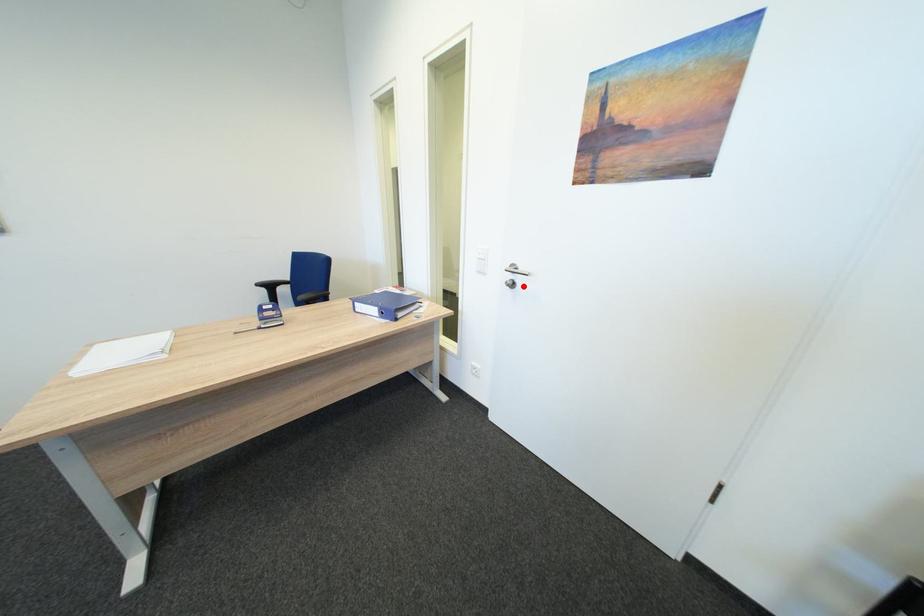
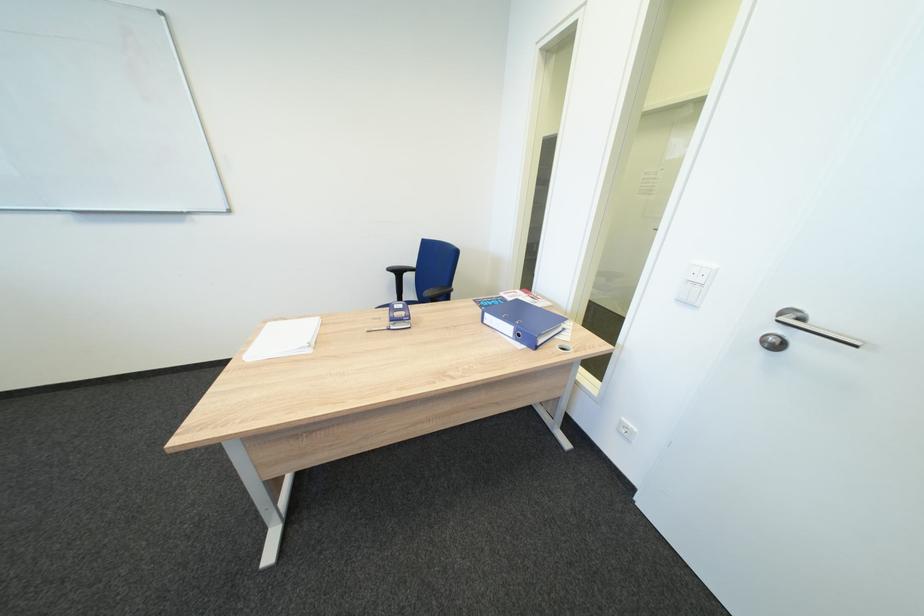
Locate, in the second image, the point that corresponds to the highlighted location in the first image.

(784, 346)